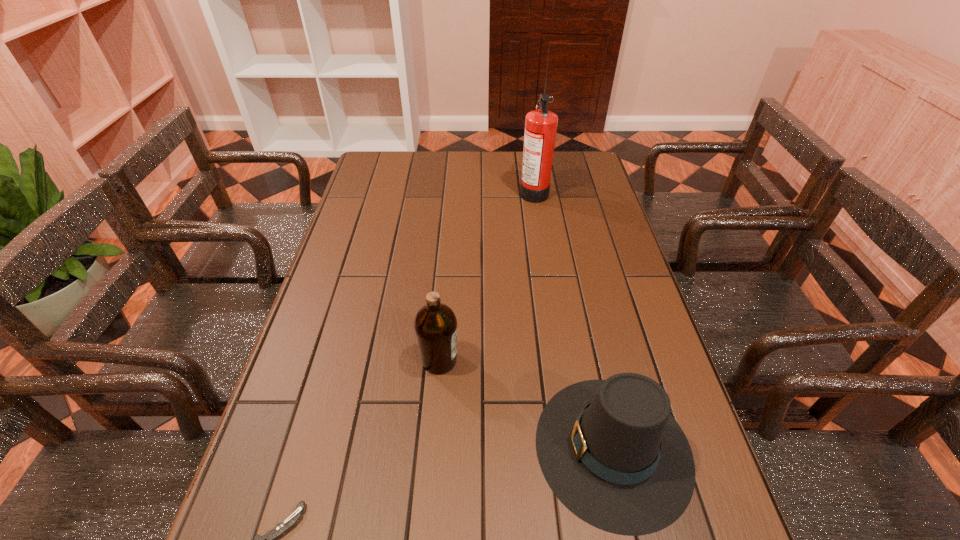
Locate an element on the screen. the farthest object is located at coordinates (541, 124).

The height and width of the screenshot is (540, 960). What are the coordinates of `the tallest object` in the screenshot? It's located at (541, 124).

Where is `the second farthest object`? Image resolution: width=960 pixels, height=540 pixels. the second farthest object is located at coordinates (435, 324).

Identify the location of the third object from right to left. (435, 324).

Locate an element on the screen. The height and width of the screenshot is (540, 960). hat is located at coordinates (611, 452).

Where is `free region located 0.270m on the front-facing side of the farthest object`? This screenshot has height=540, width=960. free region located 0.270m on the front-facing side of the farthest object is located at coordinates (444, 191).

The width and height of the screenshot is (960, 540). In order to click on free space located on the front-facing side of the farthest object in this screenshot , I will do 423,191.

This screenshot has width=960, height=540. I want to click on blank space located on the front-facing side of the farthest object, so click(x=492, y=191).

Identify the location of free space located 0.120m on the label of the olive oil. (510, 360).

The image size is (960, 540). Find the location of `free space located 0.260m on the front-facing side of the hat`. free space located 0.260m on the front-facing side of the hat is located at coordinates (407, 448).